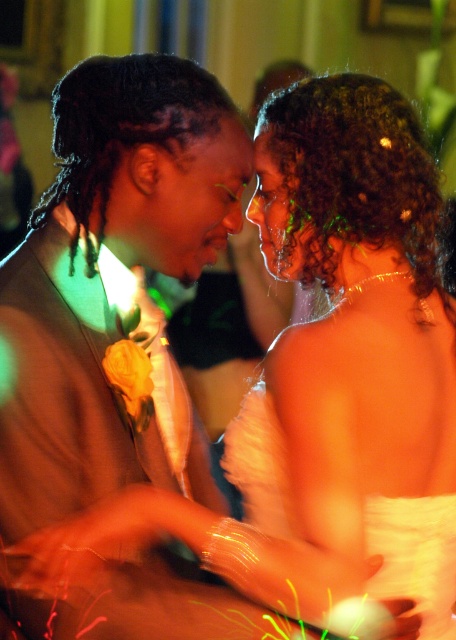
Does white satin dress at center have a larger size compared to matte brown suit at left?

→ Incorrect, white satin dress at center is not larger than matte brown suit at left.

Between point (245, 483) and point (176, 152), which one is positioned in front?

Point (176, 152)

At what (x,y) coordinates should I click in order to perform the action: click on white satin dress at center. Please return your answer as a coordinate pair (x, y). This screenshot has width=456, height=640. Looking at the image, I should click on (347, 365).